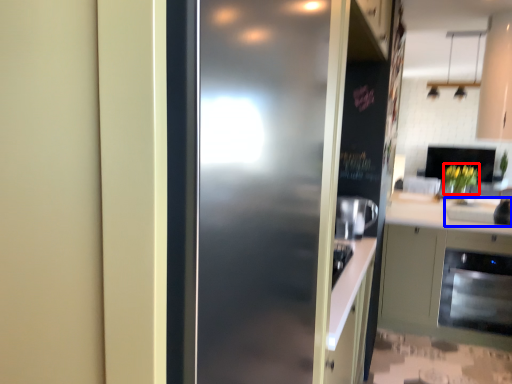
Question: Among these objects, which one is nearest to the camera, flower (highlighted by a red box) or sink (highlighted by a blue box)?

Choices:
 (A) flower
 (B) sink

Answer: (B)